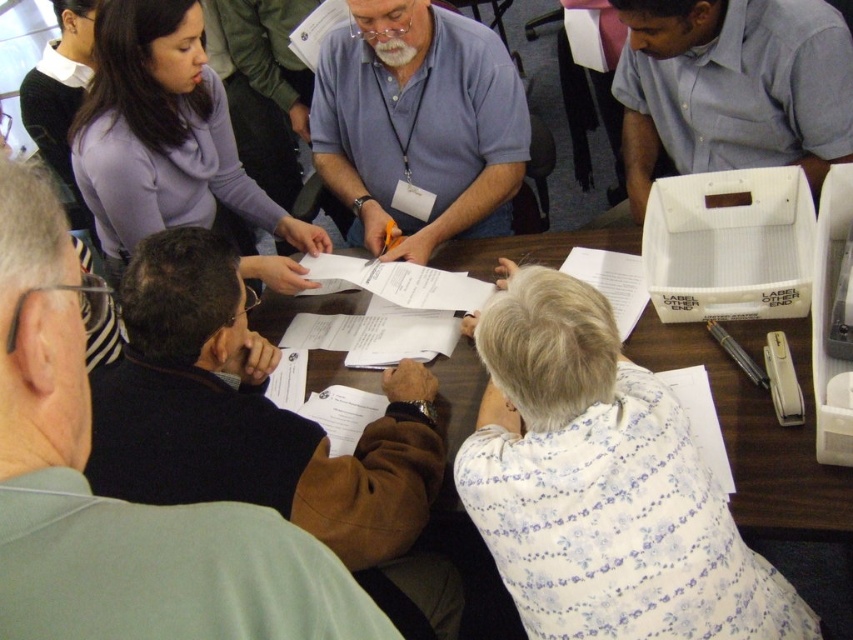
You are organizing a coat rack for the group. The dark brown leather jacket at lower left and the light blue shirt at upper right are both hanging on the rack. Which one requires less space on the rack?

The dark brown leather jacket at lower left has a smaller size compared to the light blue shirt at upper right, so it requires less space on the rack.

You are a photographer taking a group photo of the people around the table. You notice the dark brown leather jacket at lower left and the blue shirt at center. Which clothing item should you adjust to ensure both are fully visible in the frame?

The dark brown leather jacket at lower left is shorter than the blue shirt at center. To ensure both are fully visible, adjust the angle or position to account for the height difference between the dark brown leather jacket at lower left and the blue shirt at center.